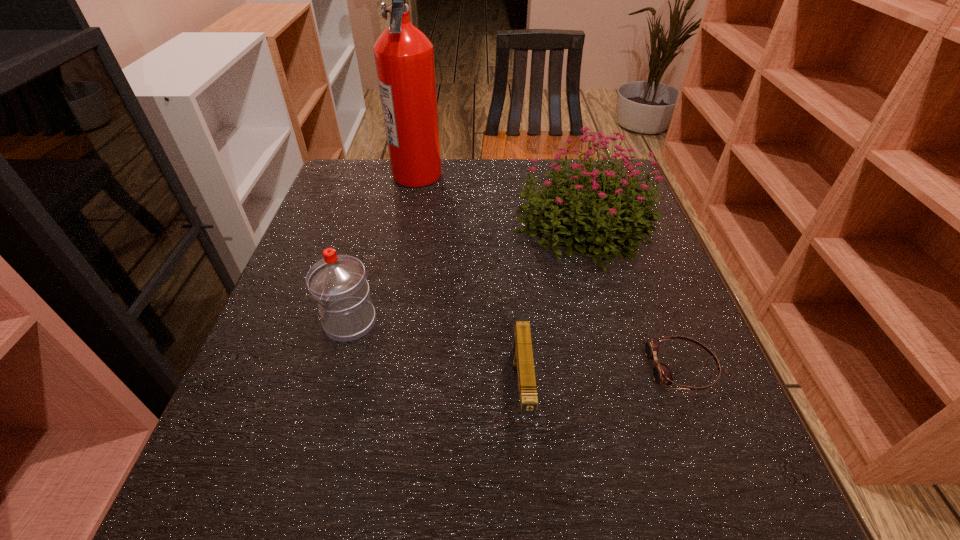
You are a GUI agent. You are given a task and a screenshot of the screen. Output one action in this format:
    pyautogui.click(x=<x>, y=<y>)
    Task: Click on the tallest object
    The image size is (960, 540).
    Given the screenshot: What is the action you would take?
    pyautogui.click(x=404, y=56)

I want to click on bouquet, so click(x=600, y=233).

Where is `water bottle`? Image resolution: width=960 pixels, height=540 pixels. water bottle is located at coordinates (x=337, y=282).

At what (x,y) coordinates should I click in order to perform the action: click on the second shortest object. Please return your answer as a coordinate pair (x, y). This screenshot has width=960, height=540. Looking at the image, I should click on (522, 354).

You are a GUI agent. You are given a task and a screenshot of the screen. Output one action in this format:
    pyautogui.click(x=<x>, y=<y>)
    Task: Click on the shortest object
    
    Given the screenshot: What is the action you would take?
    pyautogui.click(x=661, y=374)

Find the location of a particular element. free space located 0.370m at the nozzle of the fire extinguisher is located at coordinates (572, 174).

This screenshot has height=540, width=960. Find the location of `vacant space located 0.130m on the front of the fourth shortest object`. vacant space located 0.130m on the front of the fourth shortest object is located at coordinates (605, 322).

Locate an element on the screen. This screenshot has height=540, width=960. free space located 0.080m on the handle side of the third shortest object is located at coordinates (282, 322).

You are a GUI agent. You are given a task and a screenshot of the screen. Output one action in this format:
    pyautogui.click(x=<x>, y=<y>)
    Task: Click on the free space located at the barrel of the fourth tallest object
    This screenshot has height=540, width=960.
    Given the screenshot: What is the action you would take?
    pyautogui.click(x=528, y=482)

Identify the location of free space located 0.170m through the lenses of the shortest object. (553, 368).